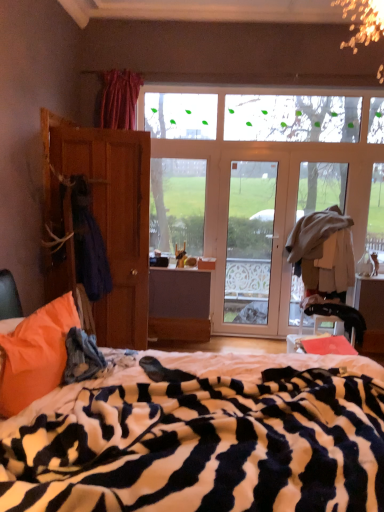
Question: Is zebra-patterned blanket at center closer to camera compared to dark blue fabric at left?

Choices:
 (A) yes
 (B) no

Answer: (A)

Question: From a real-world perspective, is zebra-patterned blanket at center on top of dark blue fabric at left?

Choices:
 (A) no
 (B) yes

Answer: (A)

Question: Is zebra-patterned blanket at center at the left side of dark blue fabric at left?

Choices:
 (A) yes
 (B) no

Answer: (B)

Question: Is the surface of zebra-patterned blanket at center in direct contact with dark blue fabric at left?

Choices:
 (A) no
 (B) yes

Answer: (A)

Question: From the image's perspective, is zebra-patterned blanket at center on top of dark blue fabric at left?

Choices:
 (A) yes
 (B) no

Answer: (B)

Question: Does point (100, 261) appear closer or farther from the camera than point (261, 202)?

Choices:
 (A) farther
 (B) closer

Answer: (B)

Question: Considering the positions of dark blue fabric at left and clear glass door at center in the image, is dark blue fabric at left bigger or smaller than clear glass door at center?

Choices:
 (A) big
 (B) small

Answer: (B)

Question: In terms of width, does dark blue fabric at left look wider or thinner when compared to clear glass door at center?

Choices:
 (A) thin
 (B) wide

Answer: (B)

Question: Is dark blue fabric at left in front of or behind clear glass door at center in the image?

Choices:
 (A) front
 (B) behind

Answer: (A)

Question: Would you say black leather swivel chair at lower right is to the left or to the right of dark blue fabric at left in the picture?

Choices:
 (A) right
 (B) left

Answer: (A)

Question: From a real-world perspective, relative to dark blue fabric at left, is black leather swivel chair at lower right vertically above or below?

Choices:
 (A) above
 (B) below

Answer: (B)

Question: Looking at their shapes, would you say black leather swivel chair at lower right is wider or thinner than dark blue fabric at left?

Choices:
 (A) thin
 (B) wide

Answer: (A)

Question: From the image's perspective, is black leather swivel chair at lower right above or below dark blue fabric at left?

Choices:
 (A) above
 (B) below

Answer: (B)

Question: Based on their positions, is orange soft pillow at lower left located to the left or right of blue fuzzy blanket at lower left?

Choices:
 (A) left
 (B) right

Answer: (A)

Question: Is point (16, 397) closer or farther from the camera than point (74, 334)?

Choices:
 (A) farther
 (B) closer

Answer: (B)